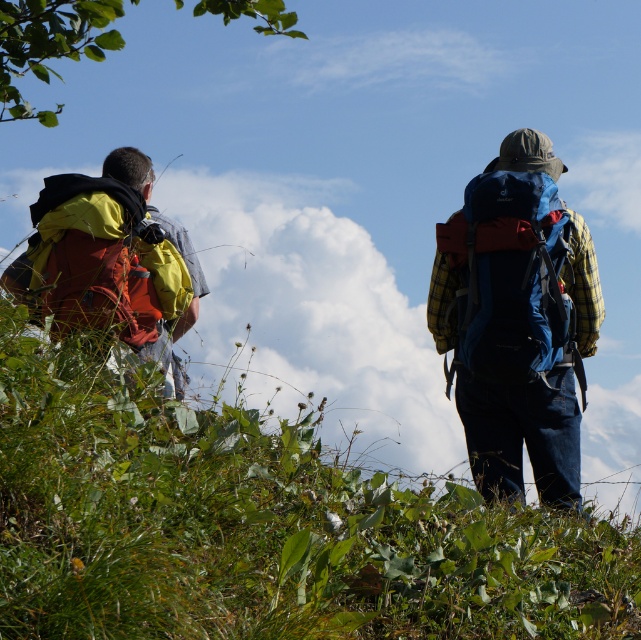
You are standing at the point marked as point (458, 262) in the image. You want to take a photo of the two hikers in the scene. Since you are 7.59 meters away from the viewer, will you be able to capture both hikers in your photo frame?

The point (458, 262) is 7.59 meters away from the viewer. Since the two hikers are part of the scene viewed by the viewer, you can capture both hikers in your photo frame as you are positioned at the same viewpoint as the viewer, just 7.59 meters away.

You are a photographer trying to capture both the blue fabric backpack at right and the matte red backpack at left in a single shot. Which backpack will appear closer to the camera in the photo?

The blue fabric backpack at right will appear closer to the camera because it is positioned further to the viewer than the matte red backpack at left.

Looking at this image, you are a photographer trying to capture both the blue fabric backpack at right and the matte red backpack at left in a single frame. Since you can only adjust your position horizontally, can you move to the left or right to ensure both backpacks are visible in your camera view?

Since the blue fabric backpack at right is to the right of the matte red backpack at left, you can move to the left to ensure both backpacks are visible in your camera view.